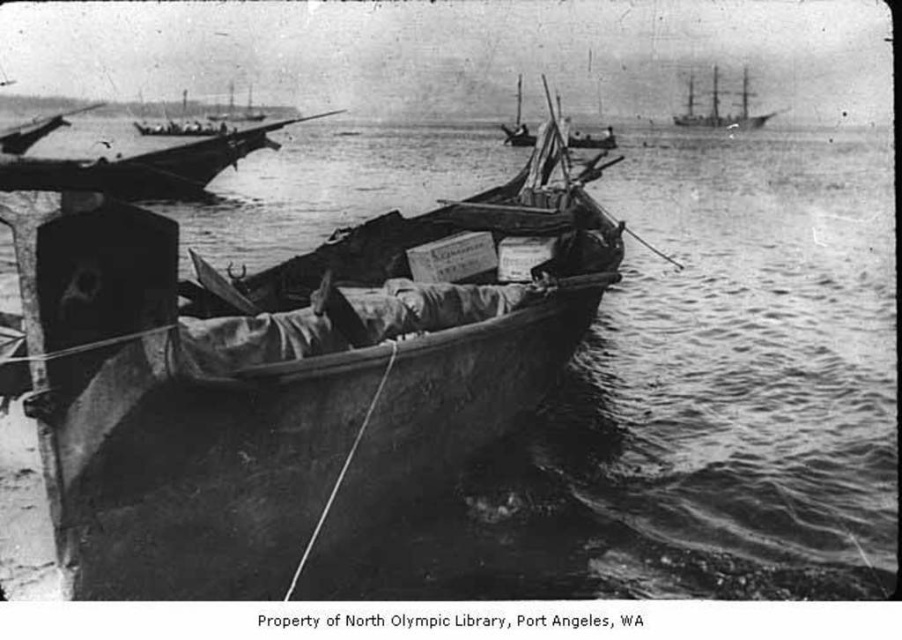
Question: Is wooden boat at upper left to the left of rusty metal boat at center from the viewer's perspective?

Choices:
 (A) no
 (B) yes

Answer: (B)

Question: Which object is the closest to the wooden ship at upper right?

Choices:
 (A) wooden boat at center
 (B) rusty metal boat at center

Answer: (B)

Question: Which object appears farthest from the camera in this image?

Choices:
 (A) wooden ship at upper right
 (B) wooden boat at upper left
 (C) rusty metal boat at center

Answer: (A)

Question: Is the position of wooden boat at center more distant than that of wooden ship at upper right?

Choices:
 (A) yes
 (B) no

Answer: (B)

Question: Can you confirm if wooden ship at upper right is smaller than rusty metal boat at center?

Choices:
 (A) yes
 (B) no

Answer: (A)

Question: Which point is farther to the camera?

Choices:
 (A) wooden boat at center
 (B) rusty metal boat at center
 (C) wooden ship at upper right

Answer: (C)